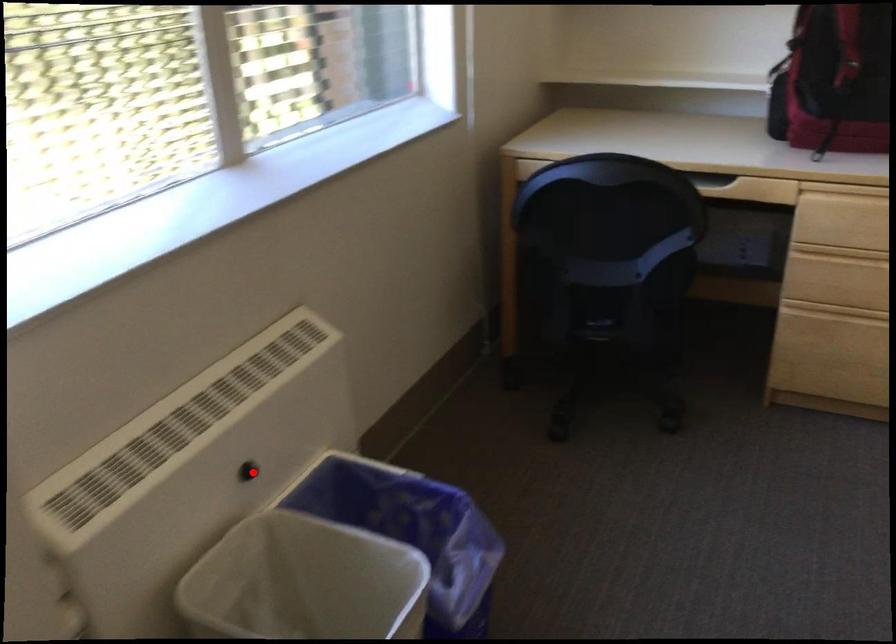
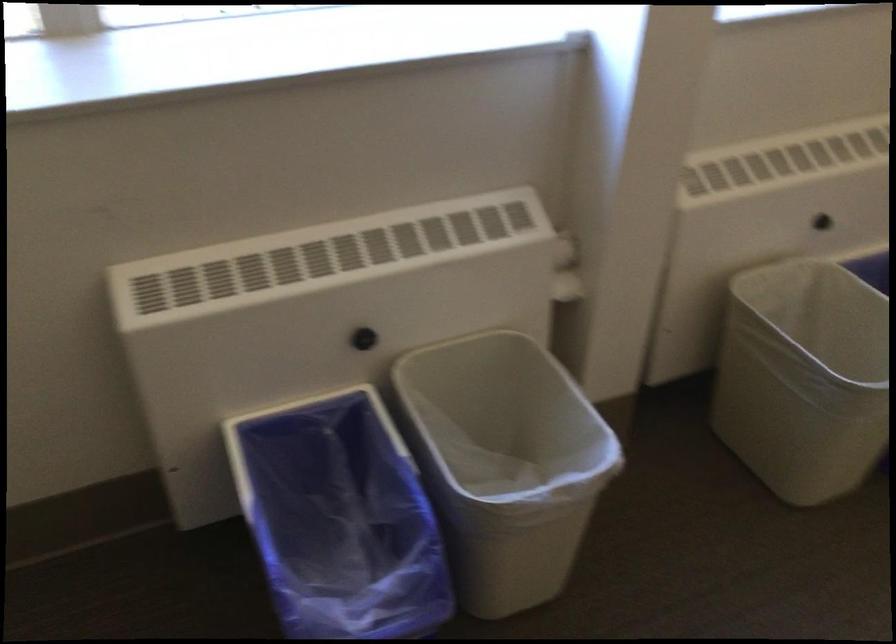
Question: I am providing you with two images of the same scene from different viewpoints. In image1, a red point is highlighted. Considering the same 3D point in image2, which of the following is correct?

Choices:
 (A) It is closer
 (B) It is farther

Answer: (B)